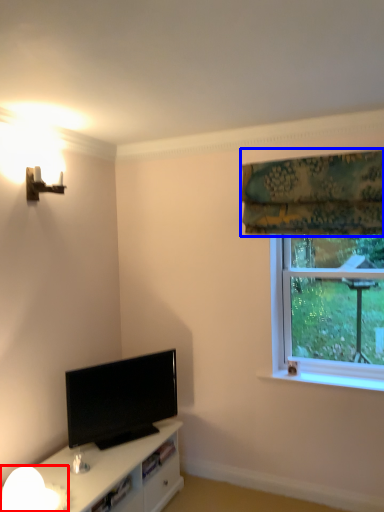
Question: Among these objects, which one is farthest to the camera, lamp (highlighted by a red box) or curtain (highlighted by a blue box)?

Choices:
 (A) lamp
 (B) curtain

Answer: (B)